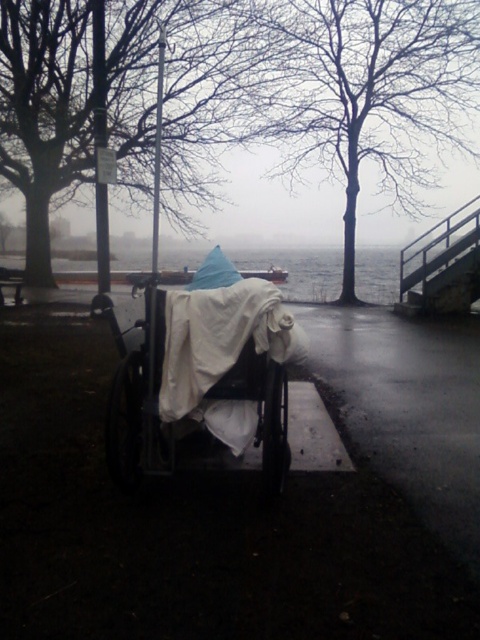
Between bare branches at upper center and white fabric-covered baby carriage at center, which one appears on the right side from the viewer's perspective?

From the viewer's perspective, bare branches at upper center appears more on the right side.

Image resolution: width=480 pixels, height=640 pixels. What do you see at coordinates (363, 92) in the screenshot?
I see `bare branches at upper center` at bounding box center [363, 92].

Image resolution: width=480 pixels, height=640 pixels. I want to click on bare branches at upper center, so click(363, 92).